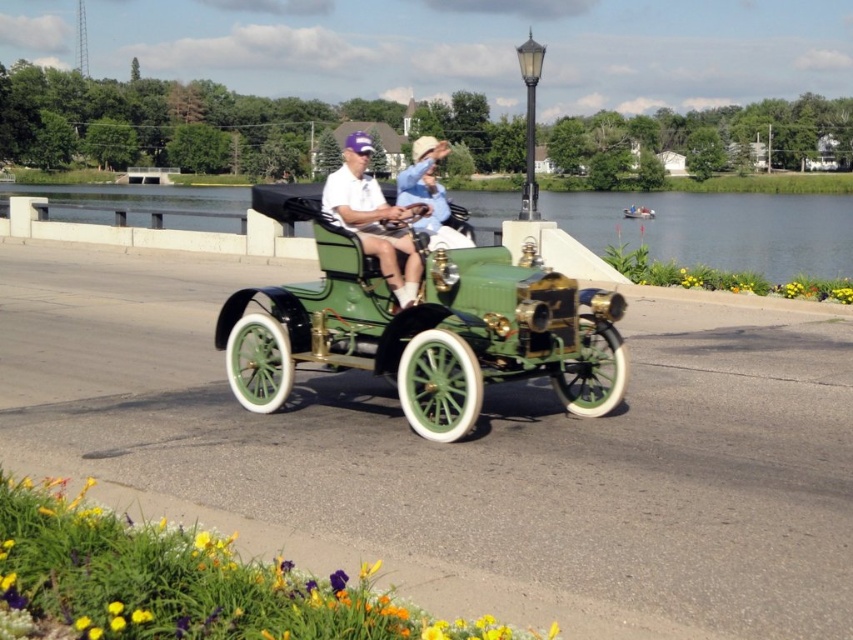
Question: Which is farther from the green polished wood water at center?

Choices:
 (A) green matte vintage car at center
 (B) matte green hat at center

Answer: (A)

Question: Considering the real-world distances, which object is closest to the green matte vintage car at center?

Choices:
 (A) matte green hat at center
 (B) green polished wood water at center

Answer: (A)

Question: Estimate the real-world distances between objects in this image. Which object is closer to the green polished wood water at center?

Choices:
 (A) matte green hat at center
 (B) green matte vintage car at center

Answer: (A)

Question: Can you confirm if green matte vintage car at center is positioned to the right of matte green hat at center?

Choices:
 (A) yes
 (B) no

Answer: (A)

Question: Is green matte vintage car at center above matte green hat at center?

Choices:
 (A) yes
 (B) no

Answer: (B)

Question: Does green matte vintage car at center appear on the left side of matte green hat at center?

Choices:
 (A) no
 (B) yes

Answer: (A)